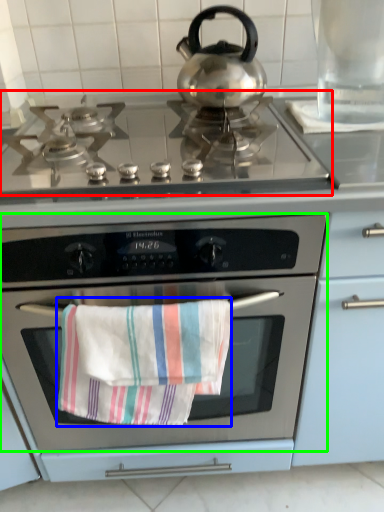
Question: Based on their relative distances, which object is farther from gas stove (highlighted by a red box)? Choose from beach towel (highlighted by a blue box) and oven (highlighted by a green box).

Choices:
 (A) beach towel
 (B) oven

Answer: (A)